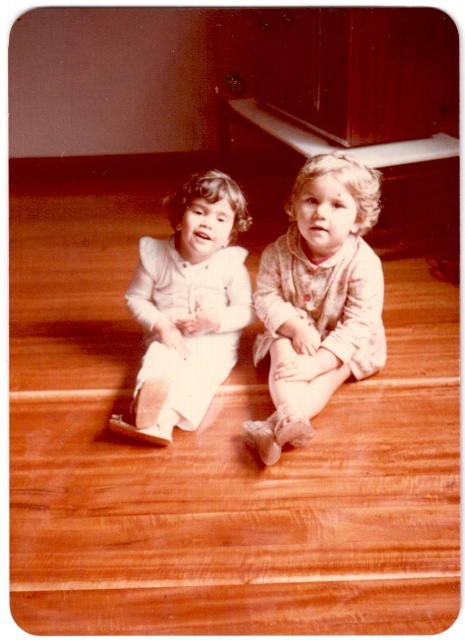
You are a photographer trying to capture the child in the white satin dress at center. Since the fluffy pink pajamas at center is covering part of them, can you adjust your angle to see the entire dress without moving any objects?

The fluffy pink pajamas at center is positioned over white satin dress at center, so adjusting your angle might allow you to see parts of the white satin dress at center not covered by the pajamas. However, since the pajamas are directly over the dress, some parts of the dress will remain obscured unless the pajamas are moved.

You are a parent trying to decide whether to place a small toy between the fluffy pink pajamas at center and the white satin dress at center. The toy is 12 inches long. Will it fit between them?

The fluffy pink pajamas at center and white satin dress at center are 11.62 inches apart. Since the toy is 12 inches long, it will not fit between them as the space is slightly smaller than the toy.

You are a parent looking at the image of your children playing on the wooden floor. You notice a point marked at coordinates (318, 300). Which child is wearing the fluffy pink pajamas at center located at that point?

The fluffy pink pajamas at center is represented by point (318, 300), so the child wearing the fluffy pink pajamas at center is located at that point.